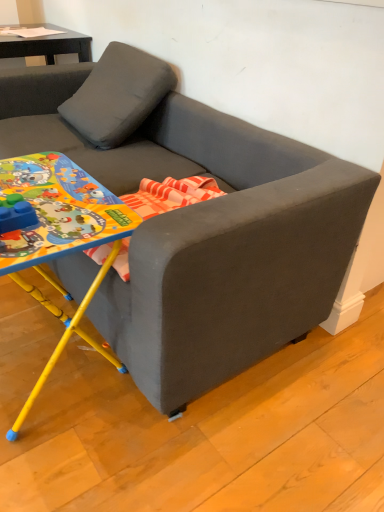
Find the location of a particular element. This screenshot has width=384, height=512. free region under yellow plastic table at lower left (from a real-world perspective) is located at coordinates (36, 353).